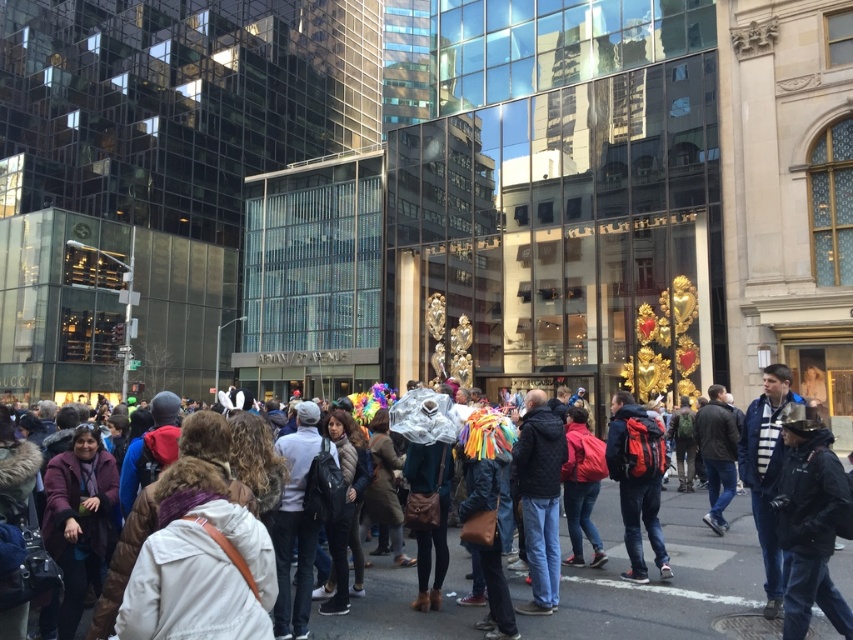
Is point (311, 620) closer to viewer compared to point (541, 593)?

Yes, it is in front of point (541, 593).

Which of these two, dark brown leather jacket at center or black quilted jacket at center, stands taller?

Standing taller between the two is black quilted jacket at center.

Does point (676, 570) come closer to viewer compared to point (526, 499)?

No, (676, 570) is behind (526, 499).

At what (x,y) coordinates should I click in order to perform the action: click on dark brown leather jacket at center. Please return your answer as a coordinate pair (x, y). The width and height of the screenshot is (853, 640). Looking at the image, I should click on (665, 580).

Can you confirm if dark brown leather jacket at center is positioned to the left of red backpack at center?

Correct, you'll find dark brown leather jacket at center to the left of red backpack at center.

Does dark brown leather jacket at center have a larger size compared to red backpack at center?

Indeed, dark brown leather jacket at center has a larger size compared to red backpack at center.

Between point (392, 605) and point (624, 444), which one is positioned in front?

Point (392, 605) is more forward.

Find the location of `dark brown leather jacket at center`. dark brown leather jacket at center is located at coordinates pos(665,580).

Is dark brown leather jacket at center further to the viewer compared to dark blue jeans at center?

No, it is not.

Is dark brown leather jacket at center wider than dark blue jeans at center?

Yes.

What do you see at coordinates (665, 580) in the screenshot? I see `dark brown leather jacket at center` at bounding box center [665, 580].

Identify the location of dark brown leather jacket at center. This screenshot has height=640, width=853. (665, 580).